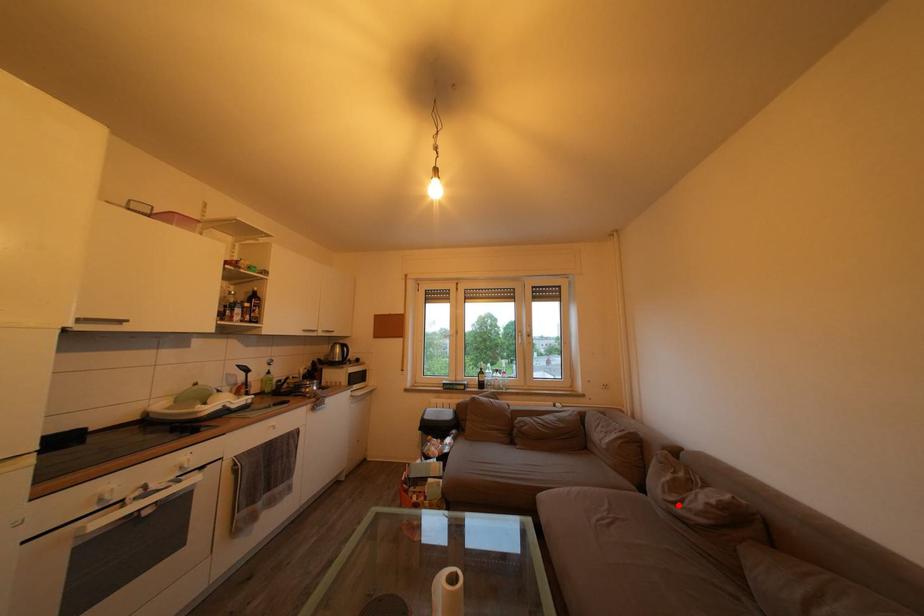
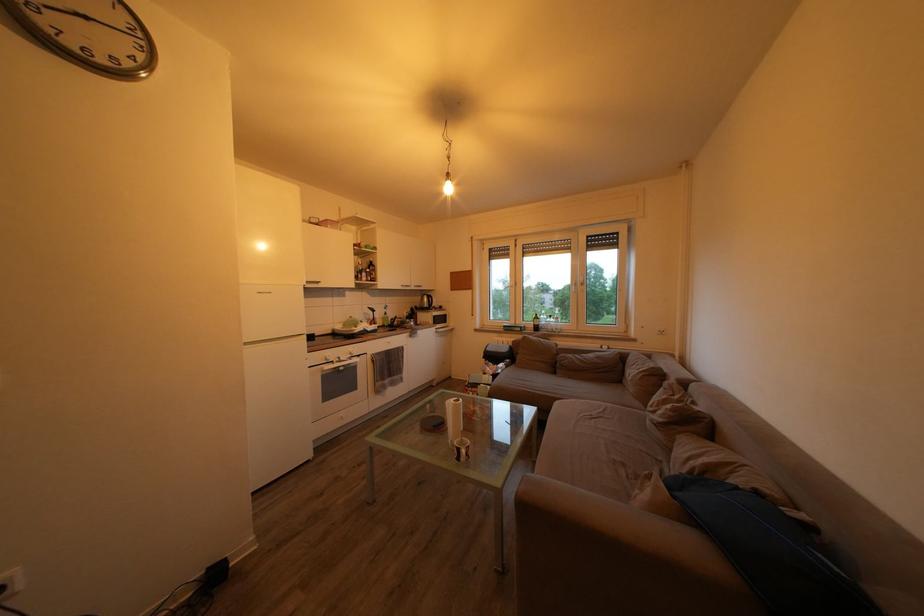
Locate, in the second image, the point that corresponds to the highlighted location in the first image.

(659, 416)